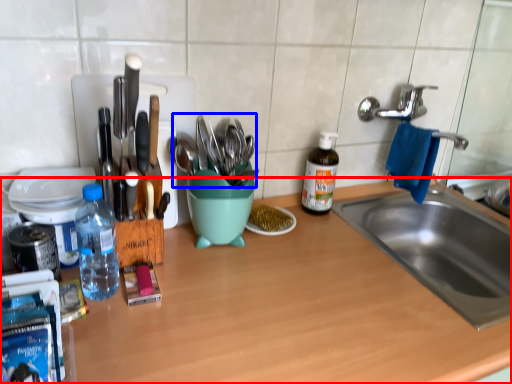
Question: Among these objects, which one is farthest to the camera, countertop (highlighted by a red box) or tableware (highlighted by a blue box)?

Choices:
 (A) countertop
 (B) tableware

Answer: (B)